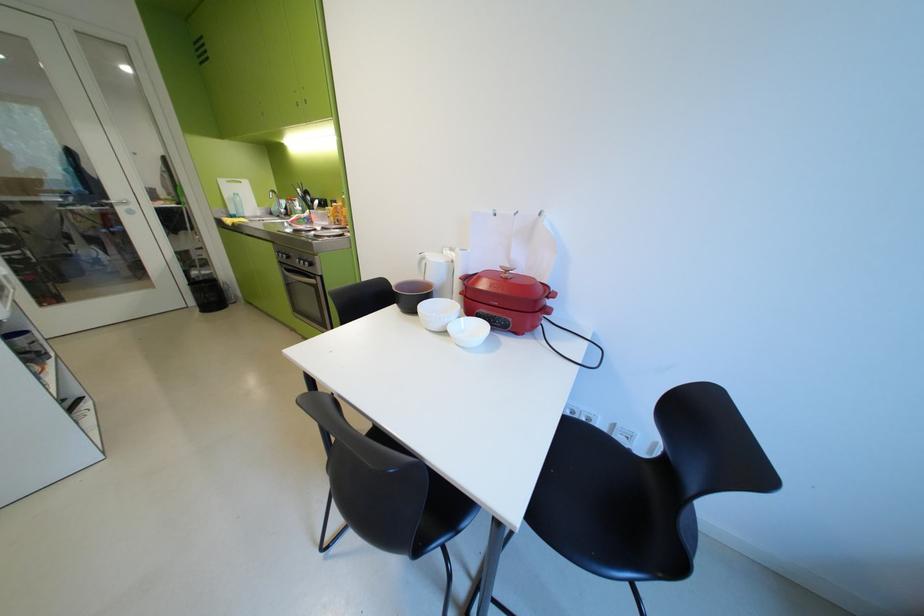
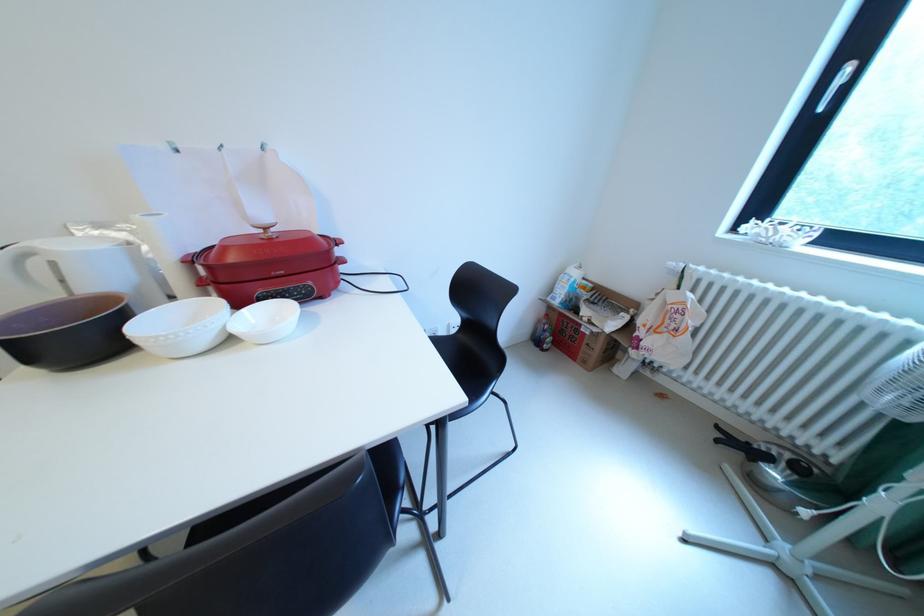
In the second image, find the point that corresponds to pixel 408 286 in the first image.

(6, 330)